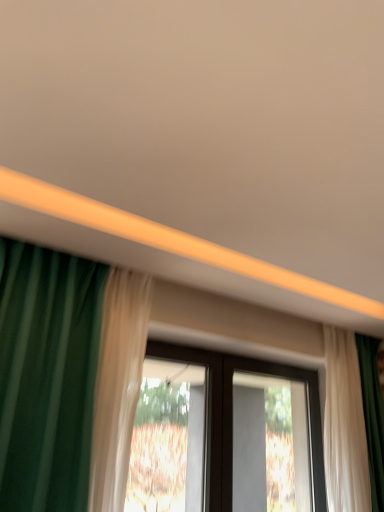
Question: Is black plastic screen door at center in front of transparent glass window at center?

Choices:
 (A) no
 (B) yes

Answer: (A)

Question: Is black plastic screen door at center with transparent glass window at center?

Choices:
 (A) yes
 (B) no

Answer: (B)

Question: Is transparent glass window at center a part of black plastic screen door at center?

Choices:
 (A) yes
 (B) no

Answer: (B)

Question: Would you say black plastic screen door at center is outside transparent glass window at center?

Choices:
 (A) no
 (B) yes

Answer: (B)

Question: From a real-world perspective, is black plastic screen door at center beneath transparent glass window at center?

Choices:
 (A) no
 (B) yes

Answer: (B)

Question: Is black plastic screen door at center smaller than transparent glass window at center?

Choices:
 (A) no
 (B) yes

Answer: (A)

Question: Does white sheer curtain at right have a lesser width compared to transparent glass window at center?

Choices:
 (A) yes
 (B) no

Answer: (B)

Question: Is white sheer curtain at right bigger than transparent glass window at center?

Choices:
 (A) yes
 (B) no

Answer: (A)

Question: Considering the relative sizes of white sheer curtain at right and transparent glass window at center in the image provided, is white sheer curtain at right smaller than transparent glass window at center?

Choices:
 (A) yes
 (B) no

Answer: (B)

Question: Is white sheer curtain at right not near transparent glass window at center?

Choices:
 (A) yes
 (B) no

Answer: (B)

Question: Does white sheer curtain at right have a greater height compared to transparent glass window at center?

Choices:
 (A) no
 (B) yes

Answer: (B)

Question: From a real-world perspective, is white sheer curtain at right physically below transparent glass window at center?

Choices:
 (A) no
 (B) yes

Answer: (A)

Question: Considering the relative sizes of transparent glass window at center and white sheer curtain at right in the image provided, is transparent glass window at center smaller than white sheer curtain at right?

Choices:
 (A) no
 (B) yes

Answer: (B)